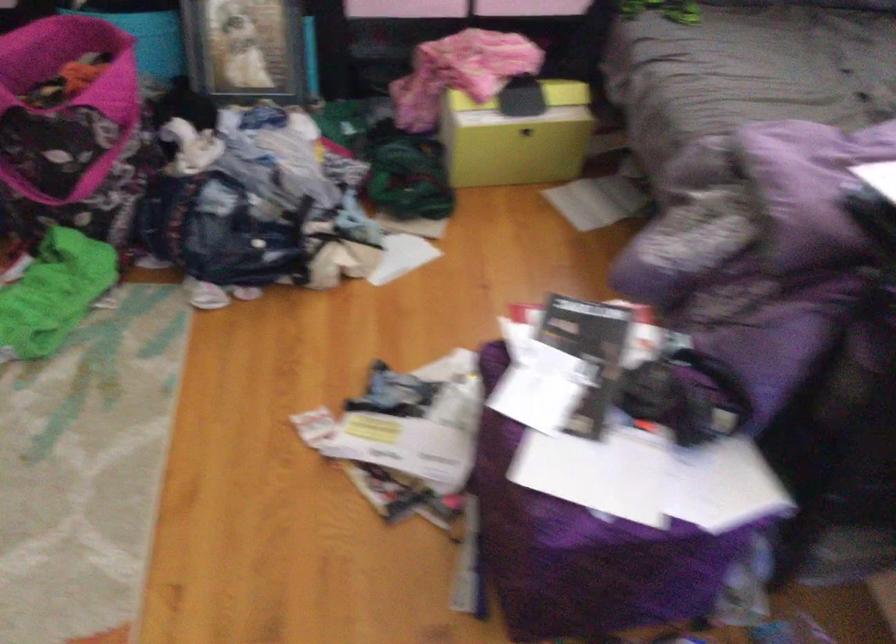
The image size is (896, 644). What do you see at coordinates (124, 67) in the screenshot?
I see `the pink basket handle` at bounding box center [124, 67].